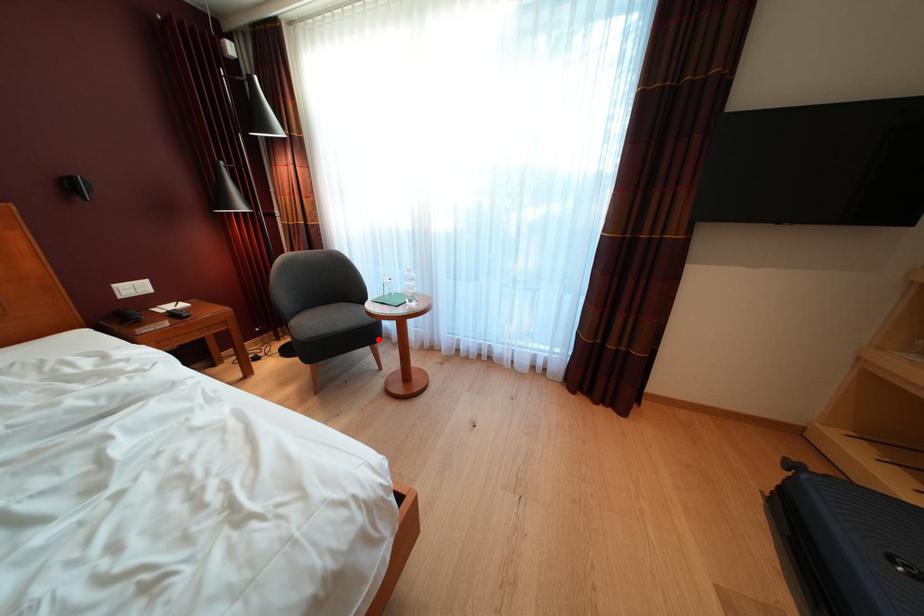
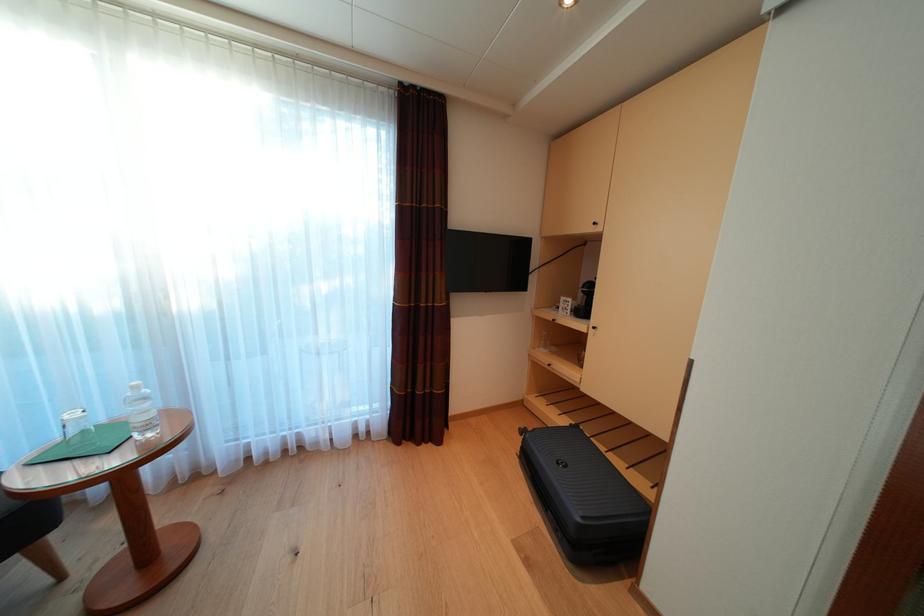
Find the pixel in the second image that matches the highlighted location in the first image.

(28, 531)